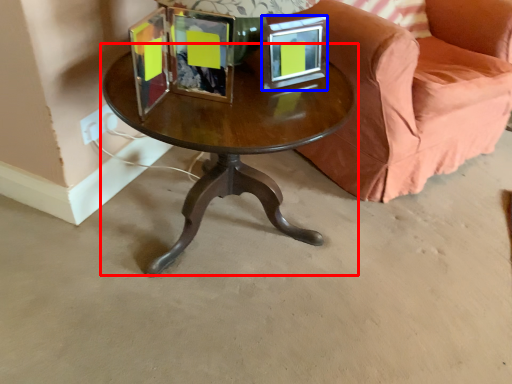
Question: Which of the following is the farthest to the observer, coffee table (highlighted by a red box) or picture frame (highlighted by a blue box)?

Choices:
 (A) coffee table
 (B) picture frame

Answer: (B)